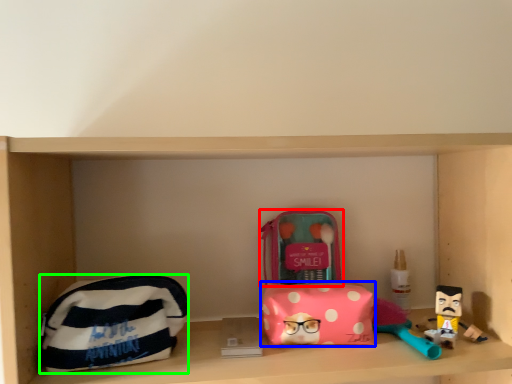
Question: Which object is the closest to the kit (highlighted by a red box)? Choose among these: pouch (highlighted by a blue box) or pouch (highlighted by a green box).

Choices:
 (A) pouch
 (B) pouch

Answer: (A)